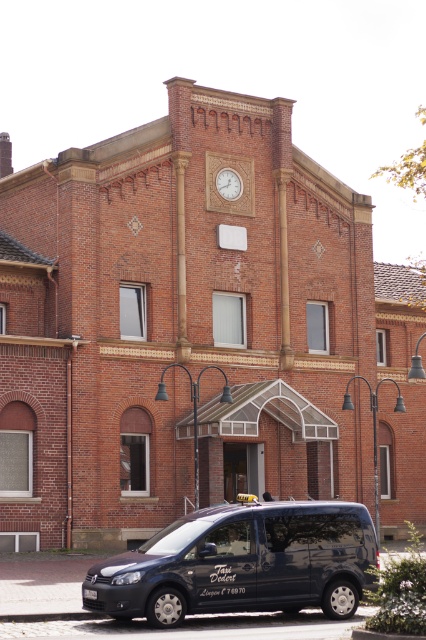
You are a delivery person trying to park your matte black van at lower center near the wooden clock at upper center. The parking space is only 2 meters wide. Can your van fit in the space?

The matte black van at lower center is larger than the wooden clock at upper center, but the size comparison between the van and the parking space is not provided. Therefore, it is uncertain if the van can fit in the 2 meter wide space.

You are a pedestrian standing at the entrance of the brick building and want to hail a taxi. You see a matte black van at lower center and a wooden clock at upper center. Which object is closer to your right side?

The wooden clock at upper center is closer to your right side because the matte black van at lower center is to the left of it, meaning the clock is positioned to the right relative to the van and thus closer to your right side.